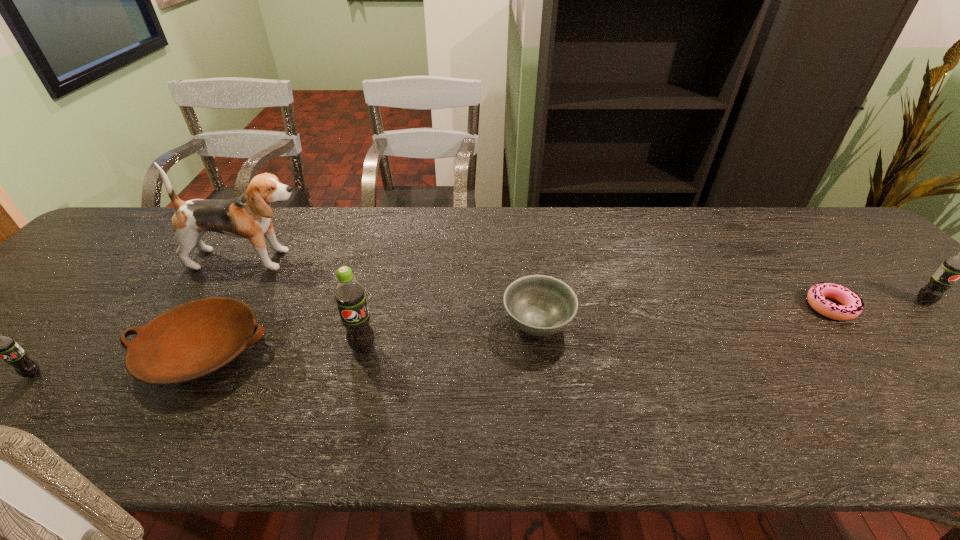
Identify the location of vacant space in between the fifth shortest object and the puppy. (588, 281).

In order to click on vacant space in between the second nearest soda and the second shortest object in this screenshot , I will do `click(283, 349)`.

The image size is (960, 540). Identify the location of free space between the second tallest object and the rightmost object. (643, 325).

The height and width of the screenshot is (540, 960). Find the location of `blank region between the shortest soda and the doughnut`. blank region between the shortest soda and the doughnut is located at coordinates 432,341.

Where is `free point between the tallest object and the fifth object from left to right`? free point between the tallest object and the fifth object from left to right is located at coordinates click(x=396, y=292).

You are a GUI agent. You are given a task and a screenshot of the screen. Output one action in this format:
    pyautogui.click(x=<x>, y=<y>)
    Task: Click on the unoccupied position between the farthest object and the fourth object from right to left
    The image size is (960, 540).
    Given the screenshot: What is the action you would take?
    pyautogui.click(x=308, y=303)

Locate an element on the screen. vacant point located between the third object from right to left and the third tallest object is located at coordinates (731, 313).

What are the coordinates of `object that stands as the sixth closest to the sixth shortest object` in the screenshot? It's located at pos(959,266).

Choose which object is the third nearest neighbor to the leftmost soda. Please provide its 2D coordinates. Your answer should be formatted as a tuple, i.e. [(x, y)], where the tuple contains the x and y coordinates of a point satisfying the conditions above.

[(349, 294)]

Locate which soda is the closest to the second shortest soda. Please provide its 2D coordinates. Your answer should be formatted as a tuple, i.e. [(x, y)], where the tuple contains the x and y coordinates of a point satisfying the conditions above.

[(349, 294)]